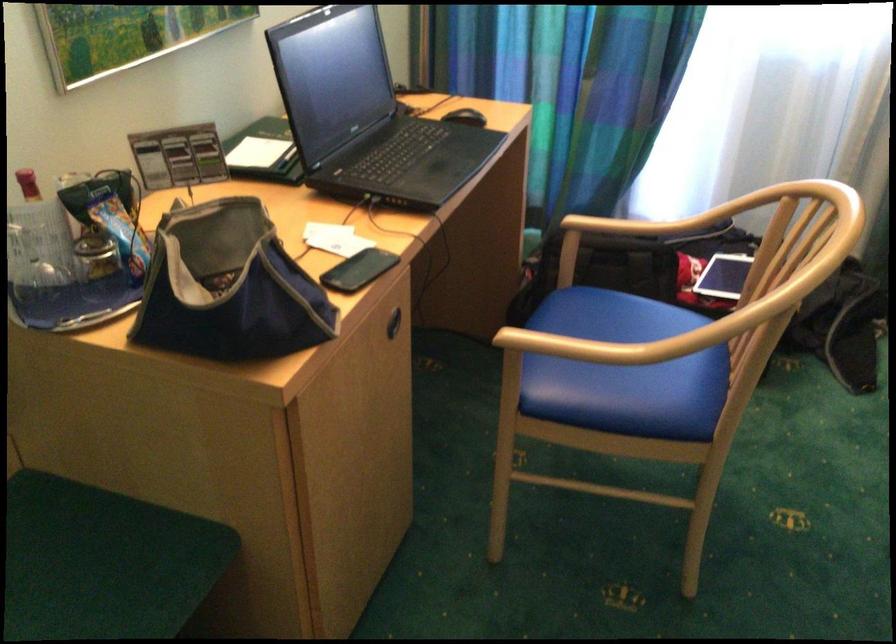
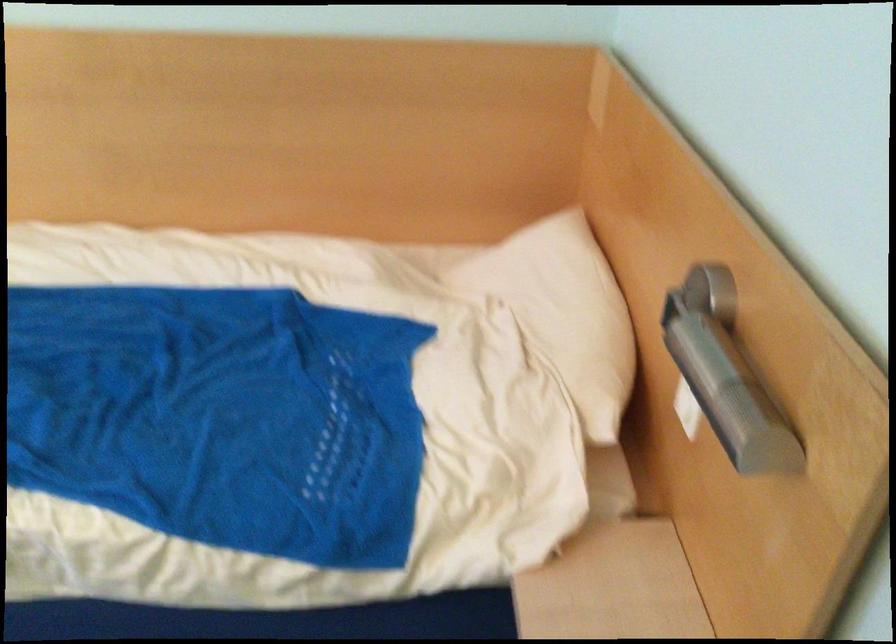
The images are taken continuously from a first-person perspective. In which direction is your viewpoint rotating?

The camera's rotation is toward right-down.